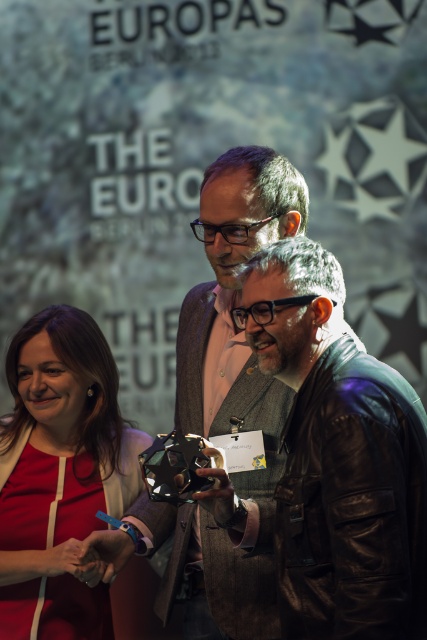
Question: Which of the following is the farthest from the observer?

Choices:
 (A) leather jacket at center
 (B) matte red dress at lower left

Answer: (B)

Question: Which point is farther to the camera?

Choices:
 (A) (421, 426)
 (B) (43, 310)

Answer: (B)

Question: Does leather jacket at center appear under matte red dress at lower left?

Choices:
 (A) no
 (B) yes

Answer: (A)

Question: Does leather jacket at center have a smaller size compared to matte red dress at lower left?

Choices:
 (A) no
 (B) yes

Answer: (B)

Question: Which object appears farthest from the camera in this image?

Choices:
 (A) leather jacket at center
 (B) matte red dress at lower left

Answer: (B)

Question: Does leather jacket at center lie in front of matte red dress at lower left?

Choices:
 (A) yes
 (B) no

Answer: (A)